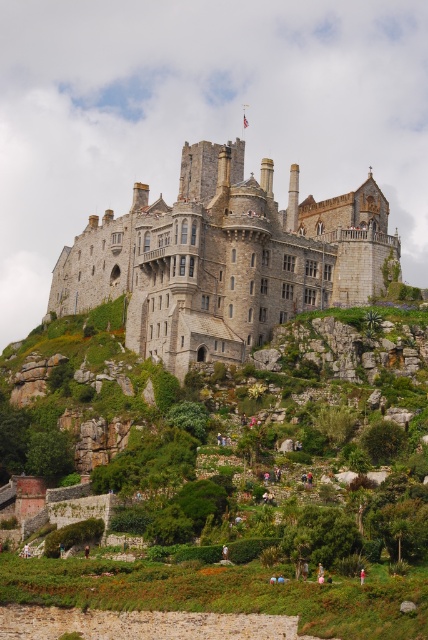
You are an artist sketching the castle scene. You notice the white cotton shirt at center and the red fabric person at center. Which object is wider when viewed from your perspective?

The white cotton shirt at center is wider than the red fabric person at center.

You are a visitor standing at the base of the castle hill. You see a red fabric person at center and a brown leather jacket at lower center. Which object appears bigger in the image?

The red fabric person at center appears bigger than the brown leather jacket at lower center in the image.